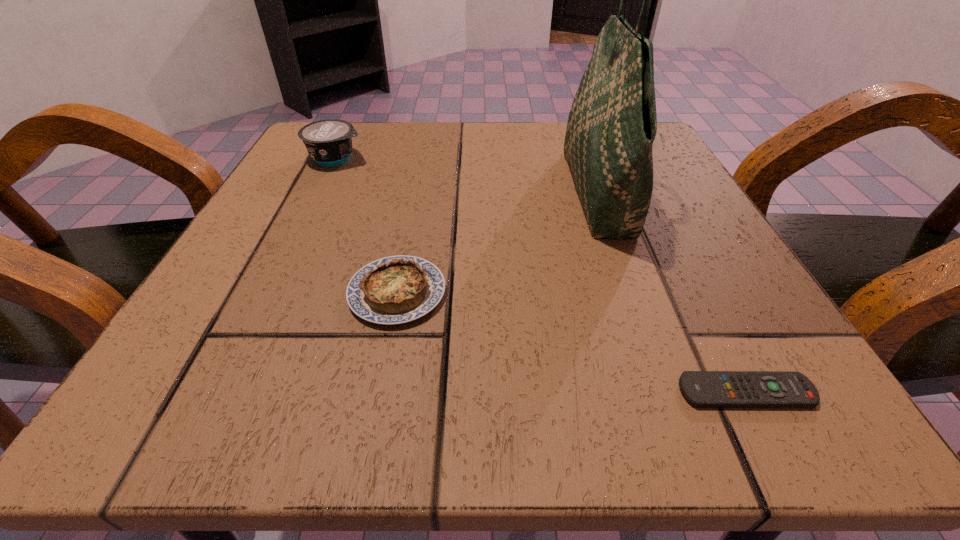
Find the location of a particular element. This screenshot has height=540, width=960. free space at the far edge of the desktop is located at coordinates (530, 168).

I want to click on vacant area at the near edge of the desktop, so click(637, 357).

Identify the location of vacant space at the left edge of the desktop. This screenshot has height=540, width=960. (295, 218).

Locate an element on the screen. The image size is (960, 540). free space at the right edge is located at coordinates (679, 238).

This screenshot has height=540, width=960. In the image, there is a desktop. Identify the location of vacant space at the far left corner. (300, 165).

The image size is (960, 540). I want to click on vacant space at the near right corner of the desktop, so click(821, 396).

Identify the location of vacant space that's between the tallest object and the shortest object. The height and width of the screenshot is (540, 960). (672, 293).

You are a GUI agent. You are given a task and a screenshot of the screen. Output one action in this format:
    pyautogui.click(x=<x>, y=<y>)
    Task: Click on the free space between the leftmost object and the tallest object
    
    Given the screenshot: What is the action you would take?
    click(468, 176)

At what (x,y) coordinates should I click in order to perform the action: click on blank region between the shortest object and the yogurt. Please return your answer as a coordinate pair (x, y). The image size is (960, 540). Looking at the image, I should click on (541, 275).

At what (x,y) coordinates should I click in order to perform the action: click on unoccupied area between the third tallest object and the shortest object. Please return your answer as a coordinate pair (x, y). This screenshot has width=960, height=540. Looking at the image, I should click on (571, 342).